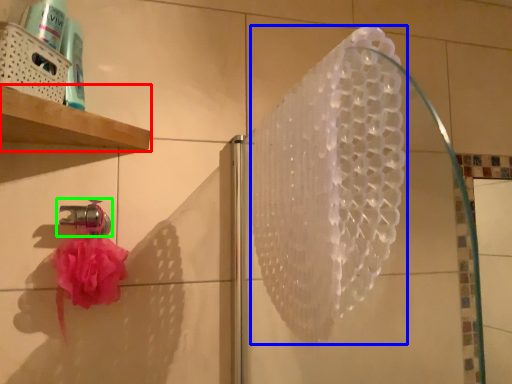
Question: Which object is positioned closest to shelf (highlighted by a red box)? Select from shower (highlighted by a blue box) and tap (highlighted by a green box).

Choices:
 (A) shower
 (B) tap

Answer: (B)